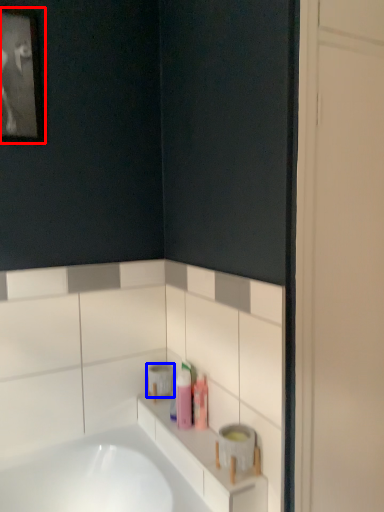
Question: Which object is further to the camera taking this photo, picture frame (highlighted by a red box) or toilet paper (highlighted by a blue box)?

Choices:
 (A) picture frame
 (B) toilet paper

Answer: (B)